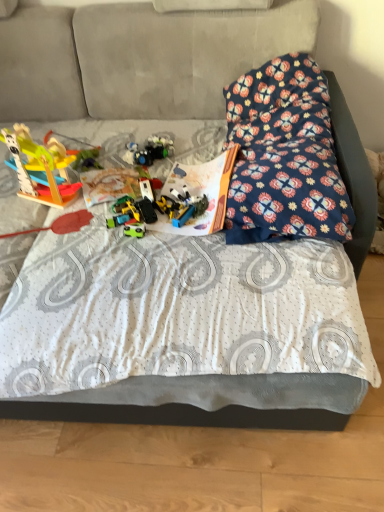
Question: Is the depth of plastic toy car at center, which is counted as the first toy, starting from the right, less than that of green plastic toy car at center, which is the 3th toy from right to left?

Choices:
 (A) no
 (B) yes

Answer: (A)

Question: Can you confirm if plastic toy car at center, which is counted as the first toy, starting from the right, is bigger than green plastic toy car at center, placed as the fourth toy when sorted from left to right?

Choices:
 (A) yes
 (B) no

Answer: (A)

Question: From a real-world perspective, is plastic toy car at center, which is counted as the first toy, starting from the right, positioned under green plastic toy car at center, which is the 3th toy from right to left, based on gravity?

Choices:
 (A) yes
 (B) no

Answer: (A)

Question: Does plastic toy car at center, which is counted as the first toy, starting from the right, have a greater height compared to green plastic toy car at center, placed as the fourth toy when sorted from left to right?

Choices:
 (A) no
 (B) yes

Answer: (B)

Question: Can you confirm if plastic toy car at center, the sixth toy when ordered from left to right, is thinner than green plastic toy car at center, placed as the fourth toy when sorted from left to right?

Choices:
 (A) no
 (B) yes

Answer: (A)

Question: Could you tell me if floral fabric pillow at upper right is turned towards plastic toy car at center, the sixth toy when ordered from left to right?

Choices:
 (A) yes
 (B) no

Answer: (B)

Question: Does floral fabric pillow at upper right have a lesser width compared to plastic toy car at center, which is counted as the first toy, starting from the right?

Choices:
 (A) no
 (B) yes

Answer: (A)

Question: Is floral fabric pillow at upper right looking in the opposite direction of plastic toy car at center, the sixth toy when ordered from left to right?

Choices:
 (A) yes
 (B) no

Answer: (B)

Question: From the image's perspective, would you say floral fabric pillow at upper right is shown under plastic toy car at center, the sixth toy when ordered from left to right?

Choices:
 (A) no
 (B) yes

Answer: (A)

Question: Could plastic toy car at center, the sixth toy when ordered from left to right, be considered to be inside floral fabric pillow at upper right?

Choices:
 (A) yes
 (B) no

Answer: (B)

Question: From the image's perspective, does floral fabric pillow at upper right appear higher than plastic toy car at center, which is counted as the first toy, starting from the right?

Choices:
 (A) yes
 (B) no

Answer: (A)

Question: Is translucent plastic toys at center, acting as the 2th toy starting from the right, smaller than wooden toy at left, the first toy viewed from the left?

Choices:
 (A) yes
 (B) no

Answer: (A)